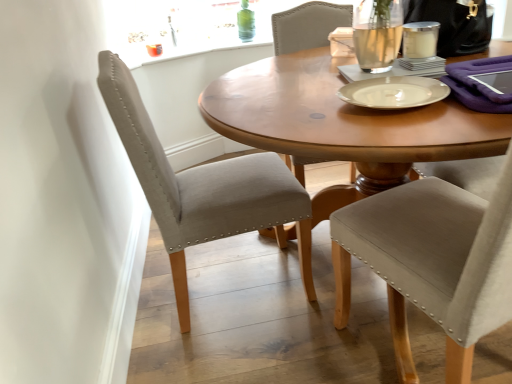
Describe the element at coordinates (394, 92) in the screenshot. I see `white matte plate at center, acting as the 1th tableware starting from the front` at that location.

The image size is (512, 384). What do you see at coordinates (432, 262) in the screenshot?
I see `satin beige chair at upper right, the 1th chair when ordered from right to left` at bounding box center [432, 262].

At what (x,y) coordinates should I click in order to perform the action: click on clear glass candle at upper right, the second tableware viewed from the front. Please return your answer as a coordinate pair (x, y). The width and height of the screenshot is (512, 384). Looking at the image, I should click on (420, 39).

Is satin beige chair at left, which ranks as the 1th chair in left-to-right order, inside the boundaries of white matte plate at center, the first tableware viewed from the left, or outside?

satin beige chair at left, which ranks as the 1th chair in left-to-right order, lies outside white matte plate at center, the first tableware viewed from the left.

From a real-world perspective, who is located lower, satin beige chair at left, the second chair viewed from the right, or white matte plate at center, placed as the first tableware when sorted from bottom to top?

In real-world perspective, satin beige chair at left, the second chair viewed from the right, is lower.

Is point (186, 222) positioned behind point (412, 86)?

Yes.

Considering the sizes of satin beige chair at left, which ranks as the 1th chair in left-to-right order, and white matte plate at center, acting as the 1th tableware starting from the front, in the image, is satin beige chair at left, which ranks as the 1th chair in left-to-right order, taller or shorter than white matte plate at center, acting as the 1th tableware starting from the front,?

Considering their sizes, satin beige chair at left, which ranks as the 1th chair in left-to-right order, has more height than white matte plate at center, acting as the 1th tableware starting from the front.

From a real-world perspective, is satin beige chair at left, which ranks as the 1th chair in left-to-right order, physically above satin beige chair at upper right, the 1th chair when ordered from right to left?

No, from a real-world perspective, satin beige chair at left, which ranks as the 1th chair in left-to-right order, is not above satin beige chair at upper right, the 1th chair when ordered from right to left.

Is point (130, 116) in front of point (374, 239)?

That is False.

Can satin beige chair at upper right, the second chair from the left, be found inside satin beige chair at left, the second chair viewed from the right?

No, satin beige chair at upper right, the second chair from the left, is not surrounded by satin beige chair at left, the second chair viewed from the right.

This screenshot has height=384, width=512. Identify the location of chair in front of the white matte plate at center, the first tableware viewed from the left. (432, 262).

Does white matte plate at center, placed as the first tableware when sorted from bottom to top, appear on the right side of satin beige chair at upper right, the second chair from the left?

No.

Looking at the image, does white matte plate at center, acting as the 1th tableware starting from the front, seem bigger or smaller compared to satin beige chair at upper right, the second chair from the left?

Considering their sizes, white matte plate at center, acting as the 1th tableware starting from the front, takes up less space than satin beige chair at upper right, the second chair from the left.

Considering the sizes of objects clear glass candle at upper right, the 1th tableware from the right, and satin beige chair at left, which ranks as the 1th chair in left-to-right order, in the image provided, who is smaller, clear glass candle at upper right, the 1th tableware from the right, or satin beige chair at left, which ranks as the 1th chair in left-to-right order,?

With smaller size is clear glass candle at upper right, the 1th tableware from the right.

How many degrees apart are the facing directions of clear glass candle at upper right, the first tableware in the top-to-bottom sequence, and satin beige chair at left, the second chair viewed from the right?

The angle between the facing direction of clear glass candle at upper right, the first tableware in the top-to-bottom sequence, and the facing direction of satin beige chair at left, the second chair viewed from the right, is 5.91 degrees.

From a real-world perspective, is clear glass candle at upper right, the 1th tableware viewed from the back, on satin beige chair at left, the second chair viewed from the right?

Yes, from a real-world perspective, clear glass candle at upper right, the 1th tableware viewed from the back, is over satin beige chair at left, the second chair viewed from the right

In the scene shown: Is clear glass candle at upper right, the 1th tableware viewed from the back, positioned in front of satin beige chair at left, the second chair viewed from the right?

No, clear glass candle at upper right, the 1th tableware viewed from the back, is further to the viewer.

Looking at this image, from the image's perspective, is clear glass candle at upper right, the second tableware viewed from the front, located above satin beige chair at upper right, the 1th chair when ordered from right to left?

Yes, from the image's perspective, clear glass candle at upper right, the second tableware viewed from the front, is over satin beige chair at upper right, the 1th chair when ordered from right to left.

How many degrees apart are the facing directions of clear glass candle at upper right, the second tableware viewed from the front, and satin beige chair at upper right, the 1th chair when ordered from right to left?

The facing directions of clear glass candle at upper right, the second tableware viewed from the front, and satin beige chair at upper right, the 1th chair when ordered from right to left, are 113 degrees apart.

Is clear glass candle at upper right, the 1th tableware viewed from the back, aimed at satin beige chair at upper right, the 1th chair when ordered from right to left?

No, clear glass candle at upper right, the 1th tableware viewed from the back, is not facing towards satin beige chair at upper right, the 1th chair when ordered from right to left.

Looking at this image, considering the sizes of objects satin beige chair at left, which ranks as the 1th chair in left-to-right order, and clear glass candle at upper right, the second tableware viewed from the front, in the image provided, who is thinner, satin beige chair at left, which ranks as the 1th chair in left-to-right order, or clear glass candle at upper right, the second tableware viewed from the front,?

clear glass candle at upper right, the second tableware viewed from the front.

Considering the positions of objects satin beige chair at left, which ranks as the 1th chair in left-to-right order, and clear glass candle at upper right, the second tableware viewed from the front, in the image provided, who is more to the right, satin beige chair at left, which ranks as the 1th chair in left-to-right order, or clear glass candle at upper right, the second tableware viewed from the front,?

clear glass candle at upper right, the second tableware viewed from the front.

Is satin beige chair at left, which ranks as the 1th chair in left-to-right order, positioned in front of clear glass candle at upper right, which ranks as the 2th tableware in bottom-to-top order?

Yes, it is.

Is there a large distance between satin beige chair at left, the second chair viewed from the right, and clear glass candle at upper right, marked as the second tableware in a left-to-right arrangement?

satin beige chair at left, the second chair viewed from the right, is near clear glass candle at upper right, marked as the second tableware in a left-to-right arrangement, not far away.

Is satin beige chair at upper right, the 1th chair when ordered from right to left, facing away from white matte plate at center, acting as the 1th tableware starting from the front?

No, satin beige chair at upper right, the 1th chair when ordered from right to left, is not facing the opposite direction of white matte plate at center, acting as the 1th tableware starting from the front.

From the image's perspective, which chair is the 2nd one below the white matte plate at center, the first tableware viewed from the left? Please provide its 2D coordinates.

[(432, 262)]

Is satin beige chair at upper right, the second chair from the left, inside or outside of white matte plate at center, which ranks as the 2th tableware in top-to-bottom order?

satin beige chair at upper right, the second chair from the left, is located beyond the bounds of white matte plate at center, which ranks as the 2th tableware in top-to-bottom order.

Does point (336, 269) appear closer or farther from the camera than point (406, 81)?

Point (336, 269) appears to be farther away from the viewer than point (406, 81).

There is a white matte plate at center, placed as the first tableware when sorted from bottom to top. At what (x,y) coordinates should I click in order to perform the action: click on the 2nd chair below it (from a real-world perspective). Please return your answer as a coordinate pair (x, y). Image resolution: width=512 pixels, height=384 pixels. Looking at the image, I should click on (203, 188).

Identify the location of chair above the satin beige chair at upper right, the 1th chair when ordered from right to left (from the image's perspective). (203, 188).

Considering their positions, is clear glass candle at upper right, the first tableware in the top-to-bottom sequence, positioned further to white matte plate at center, which is the second tableware in back-to-front order, than satin beige chair at upper right, the 1th chair when ordered from right to left?

Among the two, satin beige chair at upper right, the 1th chair when ordered from right to left, is located further to white matte plate at center, which is the second tableware in back-to-front order.

Which object lies nearer to the anchor point satin beige chair at left, which ranks as the 1th chair in left-to-right order, white matte plate at center, placed as the first tableware when sorted from bottom to top, or satin beige chair at upper right, the 1th chair when ordered from right to left?

satin beige chair at upper right, the 1th chair when ordered from right to left, lies closer to satin beige chair at left, which ranks as the 1th chair in left-to-right order, than the other object.

Which object lies further to the anchor point clear glass candle at upper right, the first tableware in the top-to-bottom sequence, satin beige chair at left, which ranks as the 1th chair in left-to-right order, or white matte plate at center, placed as the first tableware when sorted from bottom to top?

→ satin beige chair at left, which ranks as the 1th chair in left-to-right order, is further to clear glass candle at upper right, the first tableware in the top-to-bottom sequence.

When comparing their distances from satin beige chair at left, which ranks as the 1th chair in left-to-right order, does satin beige chair at upper right, the second chair from the left, or clear glass candle at upper right, the 1th tableware viewed from the back, seem further?

Among the two, clear glass candle at upper right, the 1th tableware viewed from the back, is located further to satin beige chair at left, which ranks as the 1th chair in left-to-right order.

Estimate the real-world distances between objects in this image. Which object is closer to clear glass candle at upper right, the second tableware viewed from the front, satin beige chair at upper right, the 1th chair when ordered from right to left, or satin beige chair at left, which ranks as the 1th chair in left-to-right order?

The object closer to clear glass candle at upper right, the second tableware viewed from the front, is satin beige chair at upper right, the 1th chair when ordered from right to left.

Considering their positions, is clear glass candle at upper right, which ranks as the 2th tableware in bottom-to-top order, positioned closer to white matte plate at center, acting as the 1th tableware starting from the front, than satin beige chair at left, which ranks as the 1th chair in left-to-right order?

clear glass candle at upper right, which ranks as the 2th tableware in bottom-to-top order.

Which object lies further to the anchor point satin beige chair at upper right, the second chair from the left, white matte plate at center, which is the second tableware in back-to-front order, or clear glass candle at upper right, the 1th tableware from the right?

Among the two, clear glass candle at upper right, the 1th tableware from the right, is located further to satin beige chair at upper right, the second chair from the left.

Considering their positions, is clear glass candle at upper right, the 1th tableware viewed from the back, positioned further to satin beige chair at left, the second chair viewed from the right, than white matte plate at center, which is the second tableware in back-to-front order?

clear glass candle at upper right, the 1th tableware viewed from the back, is further to satin beige chair at left, the second chair viewed from the right.

At what (x,y) coordinates should I click in order to perform the action: click on tableware between satin beige chair at upper right, the second chair from the left, and clear glass candle at upper right, marked as the second tableware in a left-to-right arrangement, along the z-axis. Please return your answer as a coordinate pair (x, y). Looking at the image, I should click on (394, 92).

Identify the location of tableware between satin beige chair at left, which ranks as the 1th chair in left-to-right order, and clear glass candle at upper right, the first tableware in the top-to-bottom sequence. (394, 92).